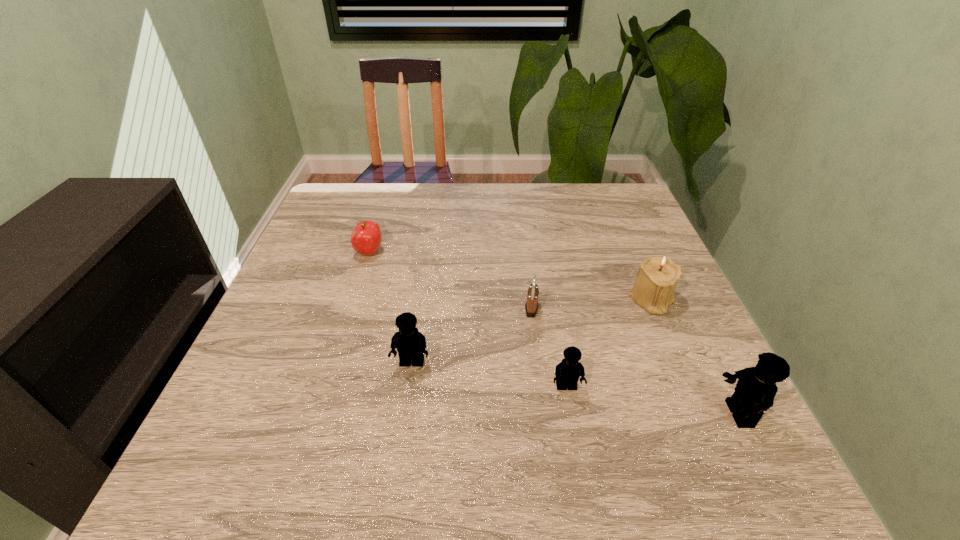
Where is `object that is positioned at the near right corner`? The height and width of the screenshot is (540, 960). object that is positioned at the near right corner is located at coordinates (755, 390).

In the image, there is a desktop. At what (x,y) coordinates should I click in order to perform the action: click on vacant space at the far edge. Please return your answer as a coordinate pair (x, y). Looking at the image, I should click on (563, 189).

Where is `vacant region at the near edge of the desktop`? The height and width of the screenshot is (540, 960). vacant region at the near edge of the desktop is located at coordinates (630, 431).

I want to click on free space at the left edge of the desktop, so click(309, 237).

This screenshot has height=540, width=960. What are the coordinates of `free point at the right edge` in the screenshot? It's located at (682, 305).

What are the coordinates of `blank space at the near left corner of the desktop` in the screenshot? It's located at (228, 429).

The image size is (960, 540). What are the coordinates of `vacant point at the far right corner` in the screenshot? It's located at coord(631,218).

Where is `vacant space at the near right corner of the desktop`? The height and width of the screenshot is (540, 960). vacant space at the near right corner of the desktop is located at coordinates (687, 424).

Locate an element on the screen. The height and width of the screenshot is (540, 960). vacant space that is in between the candle_holder and the fifth object from right to left is located at coordinates (532, 331).

Locate an element on the screen. vacant space that is in between the tallest object and the padlock is located at coordinates (635, 361).